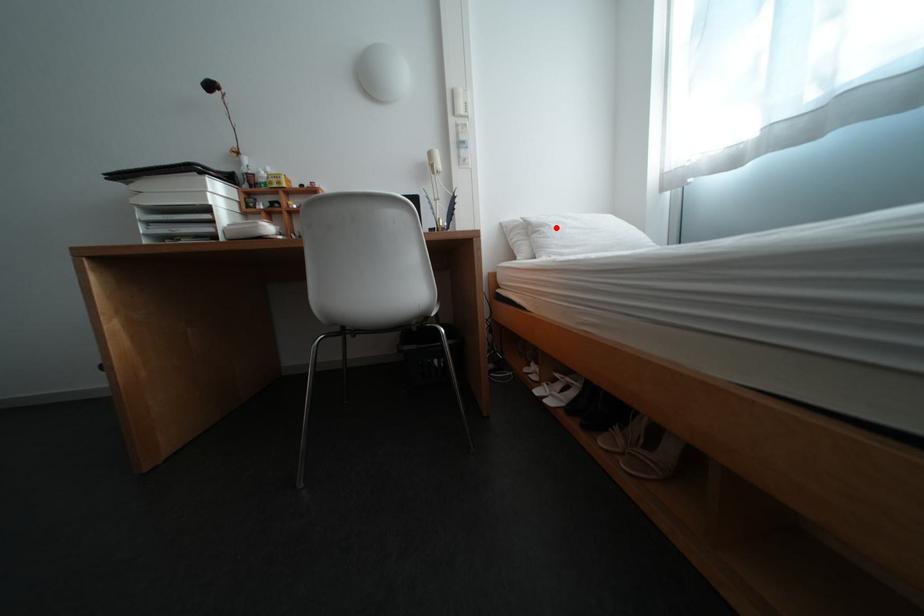
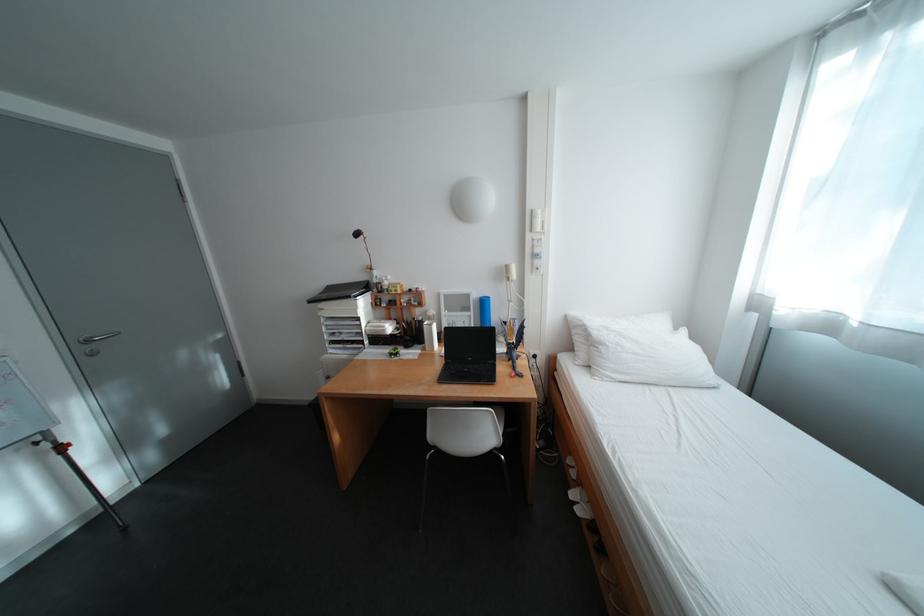
Question: I am providing you with two images of the same scene from different viewpoints. In image1, a red point is highlighted. Considering the same 3D point in image2, which of the following is correct?

Choices:
 (A) It is closer
 (B) It is farther

Answer: (B)